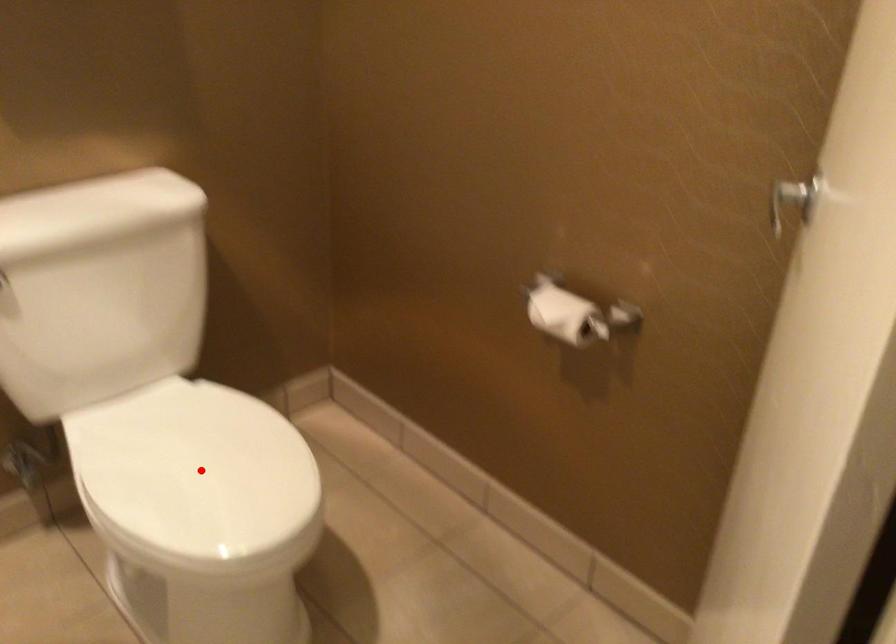
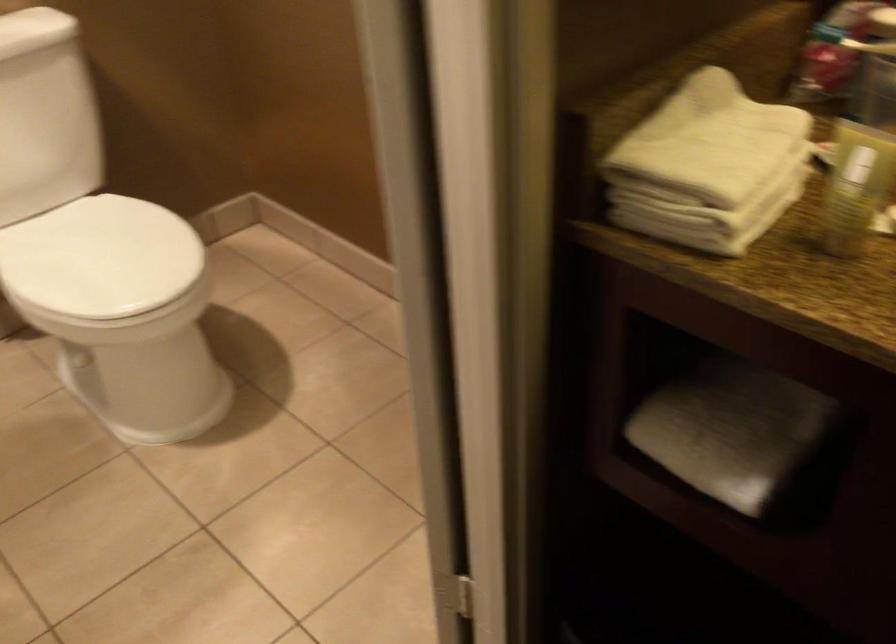
Question: A red point is marked in image1. In image2, is the corresponding 3D point closer to the camera or farther? Reply with the corresponding letter.

Choices:
 (A) The corresponding 3D point is closer.
 (B) The corresponding 3D point is farther.

Answer: (B)